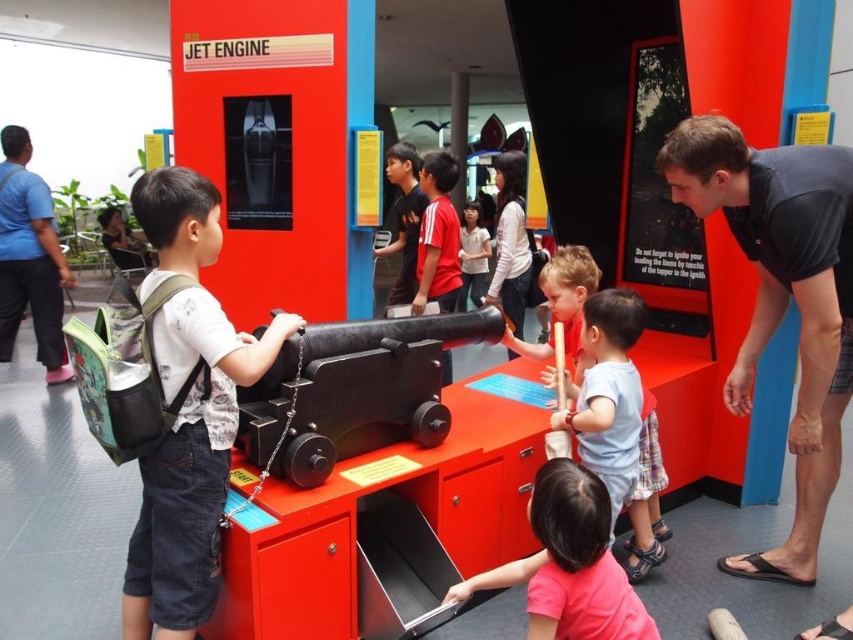
Question: Which is farther from the dark gray shirt at center?

Choices:
 (A) black short-sleeved shirt at right
 (B) matte black backpack at left

Answer: (B)

Question: Based on their relative distances, which object is farther from the brushed metal backpack at left?

Choices:
 (A) black polished cannon at center
 (B) white matte shirt at center

Answer: (A)

Question: Which point is farther to the camera?

Choices:
 (A) (796, 416)
 (B) (196, 557)

Answer: (A)

Question: Is black polished cannon at center above light blue cotton shirt at center?

Choices:
 (A) yes
 (B) no

Answer: (A)

Question: Can you confirm if pink matte shirt at lower center is positioned to the right of white matte shirt at center?

Choices:
 (A) no
 (B) yes

Answer: (A)

Question: Can you confirm if dark gray shirt at center is positioned below matte black shirt at center?

Choices:
 (A) no
 (B) yes

Answer: (B)